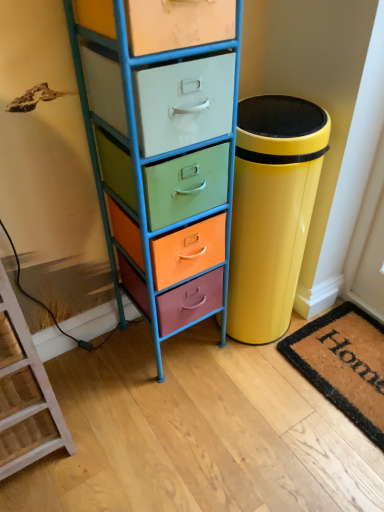
Identify the location of blank space to the left of coir doormat at lower right. This screenshot has width=384, height=512. (247, 402).